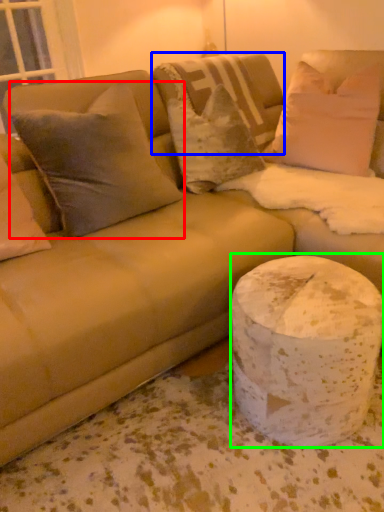
Question: Which is farther away from pillow (highlighted by a red box)? pillow (highlighted by a blue box) or marble (highlighted by a green box)?

Choices:
 (A) pillow
 (B) marble

Answer: (B)